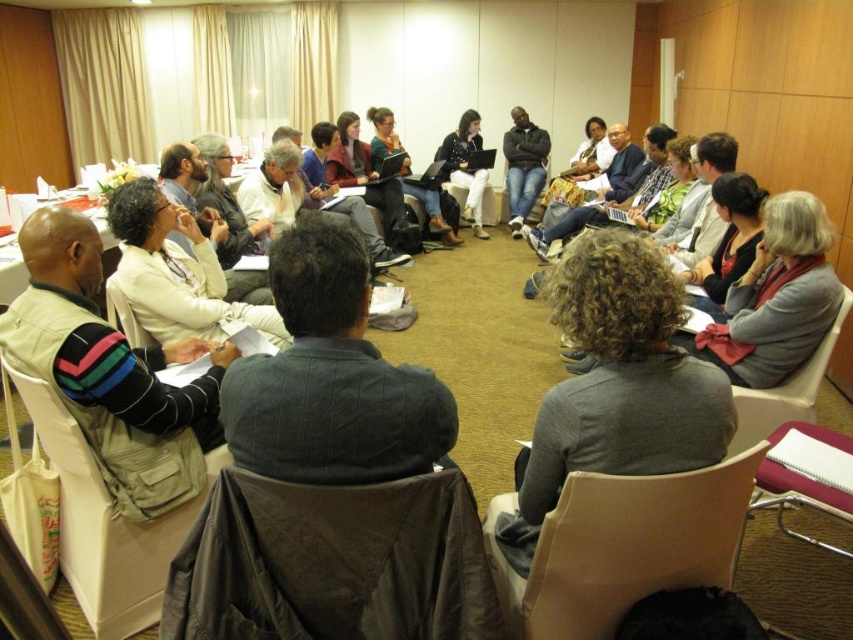
Question: Which object is positioned closest to the khaki fabric chair at lower left?

Choices:
 (A) gray sweater at center
 (B) white matte jacket at upper left
 (C) matte black laptop at center

Answer: (B)

Question: Does beige plastic chair at lower right have a greater width compared to matte black laptop at center?

Choices:
 (A) no
 (B) yes

Answer: (A)

Question: Is dark gray sweater at center bigger than matte gray chair at lower right?

Choices:
 (A) no
 (B) yes

Answer: (A)

Question: Among these objects, which one is farthest from the camera?

Choices:
 (A) gray sweater at center
 (B) matte gray chair at lower right
 (C) striped sweater at center

Answer: (B)

Question: Can you confirm if dark gray sweater at center is thinner than white matte jacket at upper left?

Choices:
 (A) yes
 (B) no

Answer: (A)

Question: Among these objects, which one is nearest to the camera?

Choices:
 (A) white matte jacket at upper left
 (B) jeans at center
 (C) khaki fabric chair at lower left
 (D) striped sweater at center

Answer: (C)